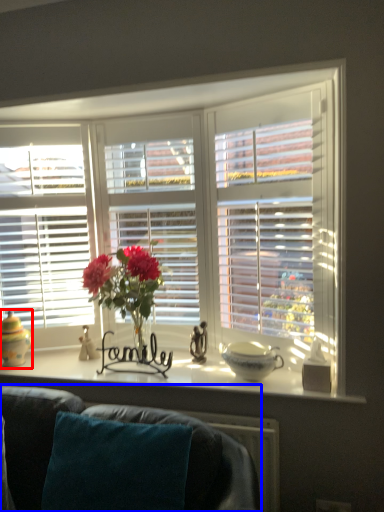
Question: Which of the following is the farthest to the observer, candle holder (highlighted by a red box) or studio couch (highlighted by a blue box)?

Choices:
 (A) candle holder
 (B) studio couch

Answer: (A)